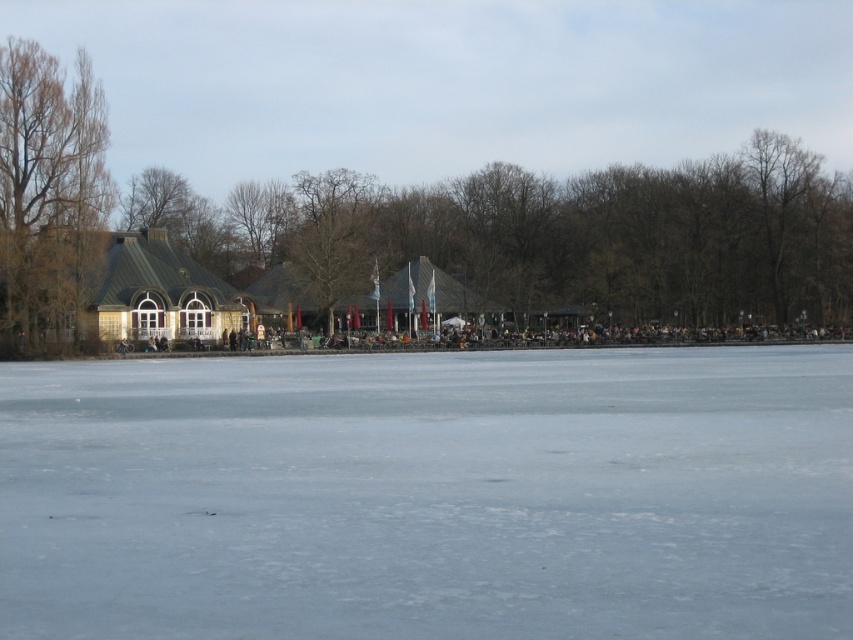
Question: Does transparent ice at center lie behind brown leafless tree at left?

Choices:
 (A) no
 (B) yes

Answer: (A)

Question: Is transparent ice at center further to the viewer compared to brown leafless tree at left?

Choices:
 (A) yes
 (B) no

Answer: (B)

Question: Which point is closer to the camera?

Choices:
 (A) brown leafless tree at left
 (B) transparent ice at center

Answer: (B)

Question: Does transparent ice at center have a smaller size compared to brown leafless tree at left?

Choices:
 (A) no
 (B) yes

Answer: (B)

Question: Which of the following is the closest to the observer?

Choices:
 (A) (281, 580)
 (B) (4, 68)

Answer: (A)